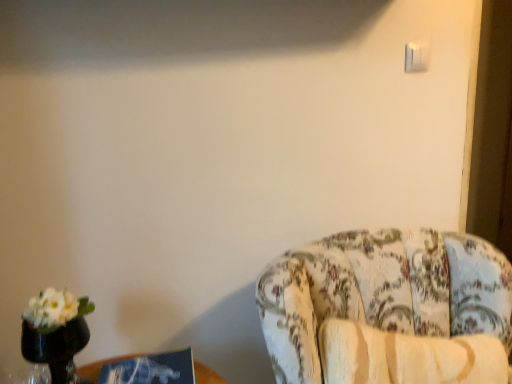
Question: Is white plastic light switch at upper right wider than floral fabric chair at right?

Choices:
 (A) yes
 (B) no

Answer: (B)

Question: Can you confirm if white plastic light switch at upper right is positioned to the left of floral fabric chair at right?

Choices:
 (A) no
 (B) yes

Answer: (A)

Question: Is white plastic light switch at upper right facing away from floral fabric chair at right?

Choices:
 (A) no
 (B) yes

Answer: (A)

Question: From a real-world perspective, does white plastic light switch at upper right sit lower than floral fabric chair at right?

Choices:
 (A) yes
 (B) no

Answer: (B)

Question: Would you say white plastic light switch at upper right is a long distance from floral fabric chair at right?

Choices:
 (A) yes
 (B) no

Answer: (B)

Question: From a real-world perspective, is white plastic light switch at upper right positioned above or below floral fabric chair at right?

Choices:
 (A) below
 (B) above

Answer: (B)

Question: Is white plastic light switch at upper right bigger or smaller than floral fabric chair at right?

Choices:
 (A) small
 (B) big

Answer: (A)

Question: In terms of width, does white plastic light switch at upper right look wider or thinner when compared to floral fabric chair at right?

Choices:
 (A) wide
 (B) thin

Answer: (B)

Question: Considering the positions of white plastic light switch at upper right and floral fabric chair at right in the image, is white plastic light switch at upper right taller or shorter than floral fabric chair at right?

Choices:
 (A) tall
 (B) short

Answer: (B)

Question: In the image, is blue cardboard box at lower left positioned in front of or behind white plastic light switch at upper right?

Choices:
 (A) behind
 (B) front

Answer: (B)

Question: Would you say blue cardboard box at lower left is inside or outside white plastic light switch at upper right?

Choices:
 (A) outside
 (B) inside

Answer: (A)

Question: From a real-world perspective, is blue cardboard box at lower left physically located above or below white plastic light switch at upper right?

Choices:
 (A) below
 (B) above

Answer: (A)

Question: Does point (200, 372) appear closer or farther from the camera than point (420, 46)?

Choices:
 (A) closer
 (B) farther

Answer: (A)

Question: Would you say white plastic light switch at upper right is to the left or to the right of blue cardboard box at lower left in the picture?

Choices:
 (A) right
 (B) left

Answer: (A)

Question: Looking at their shapes, would you say white plastic light switch at upper right is wider or thinner than blue cardboard box at lower left?

Choices:
 (A) thin
 (B) wide

Answer: (A)